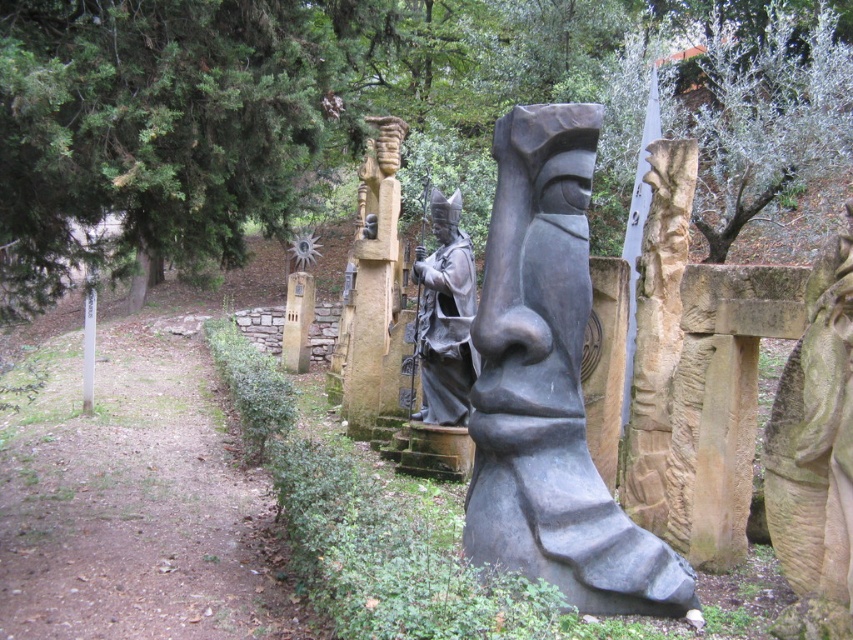
Does stone statue at right have a lesser height compared to matte gray statue at center?

Yes, stone statue at right is shorter than matte gray statue at center.

You are a GUI agent. You are given a task and a screenshot of the screen. Output one action in this format:
    pyautogui.click(x=<x>, y=<y>)
    Task: Click on the stone statue at right
    
    Given the screenshot: What is the action you would take?
    pyautogui.click(x=815, y=436)

Identify the location of stone statue at right. (815, 436).

Which of these two, green textured tree at upper left or black stone statue at center, stands shorter?

green textured tree at upper left

The image size is (853, 640). In order to click on green textured tree at upper left in this screenshot , I will do `click(157, 129)`.

Between green textured tree at upper left and stone statue at right, which one is positioned higher?

green textured tree at upper left

Between green textured tree at upper left and stone statue at right, which one has less height?

stone statue at right is shorter.

The height and width of the screenshot is (640, 853). I want to click on green textured tree at upper left, so click(157, 129).